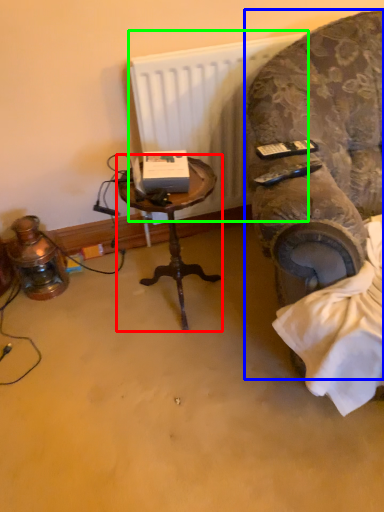
Question: Based on their relative distances, which object is farther from table (highlighted by a red box)? Choose from chair (highlighted by a blue box) and radiator (highlighted by a green box).

Choices:
 (A) chair
 (B) radiator

Answer: (A)